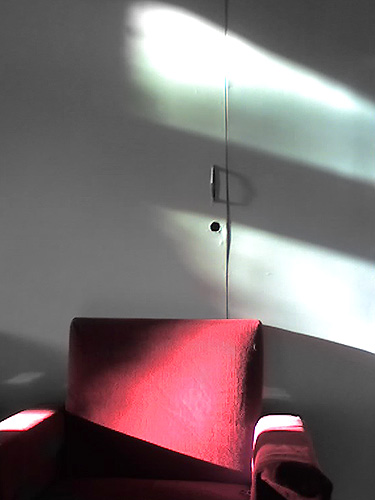
The width and height of the screenshot is (375, 500). I want to click on armchair, so click(210, 407).